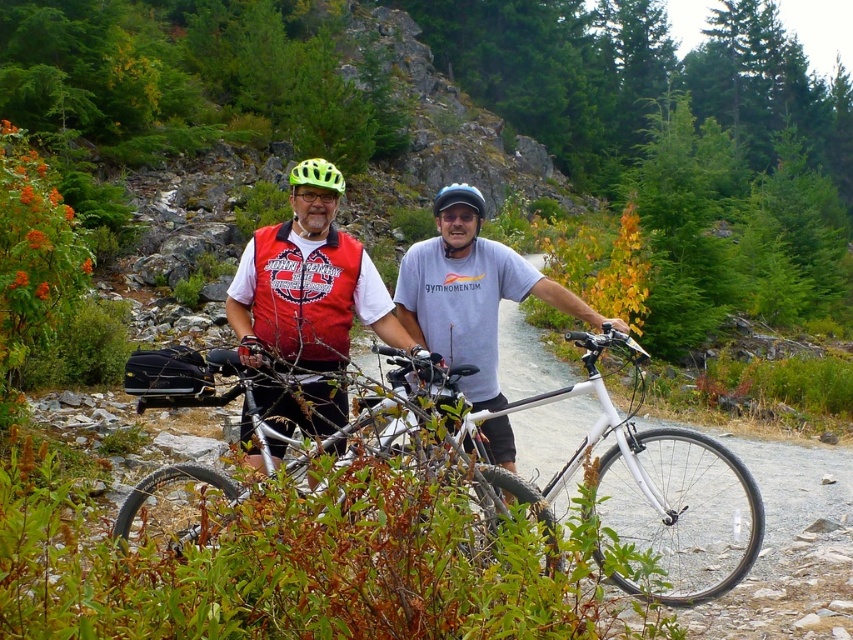
Does green matte helmet at center appear over matte black helmet at center?

No, green matte helmet at center is not above matte black helmet at center.

Does green matte helmet at center have a greater width compared to matte black helmet at center?

No.

The width and height of the screenshot is (853, 640). Describe the element at coordinates (314, 196) in the screenshot. I see `green matte helmet at center` at that location.

Locate an element on the screen. green matte helmet at center is located at coordinates (314, 196).

Is point (321, 195) positioned in front of point (294, 184)?

Yes, point (321, 195) is closer to viewer.

Who is more forward, (300, 358) or (334, 170)?

Point (334, 170)

The image size is (853, 640). In order to click on matte red vest at center in this screenshot , I will do `click(308, 289)`.

Which is below, matte red vest at center or green matte bicycle helmet at center?

matte red vest at center is lower down.

Can you confirm if matte red vest at center is bigger than green matte bicycle helmet at center?

No.

Between point (268, 388) and point (315, 176), which one is positioned in front?

Point (268, 388) is more forward.

In order to click on matte red vest at center in this screenshot , I will do `click(308, 289)`.